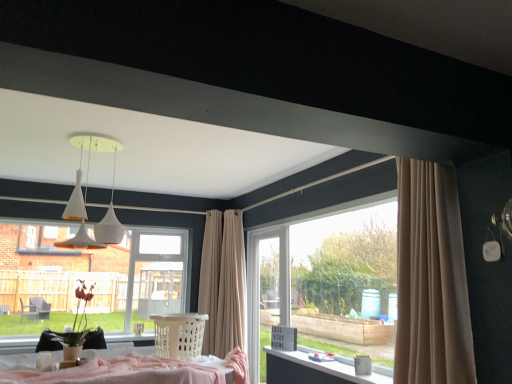
Question: From the image's perspective, is white glossy table at lower right above or below clear glass window at center?

Choices:
 (A) above
 (B) below

Answer: (B)

Question: Is white glossy table at lower right inside the boundaries of clear glass window at center, or outside?

Choices:
 (A) outside
 (B) inside

Answer: (A)

Question: Which of these objects is positioned farthest from the clear glass window at center?

Choices:
 (A) white glossy screen door at center
 (B) white plastic laundry basket at center
 (C) beige fabric curtain at center
 (D) white glossy table at lower right
 (E) white matte pendant lights at upper center

Answer: (D)

Question: Estimate the real-world distances between objects in this image. Which object is farther from the white matte pendant lights at upper center?

Choices:
 (A) beige fabric curtain at center
 (B) white glossy screen door at center
 (C) clear glass window at center
 (D) white glossy table at lower right
 (E) white plastic laundry basket at center

Answer: (D)